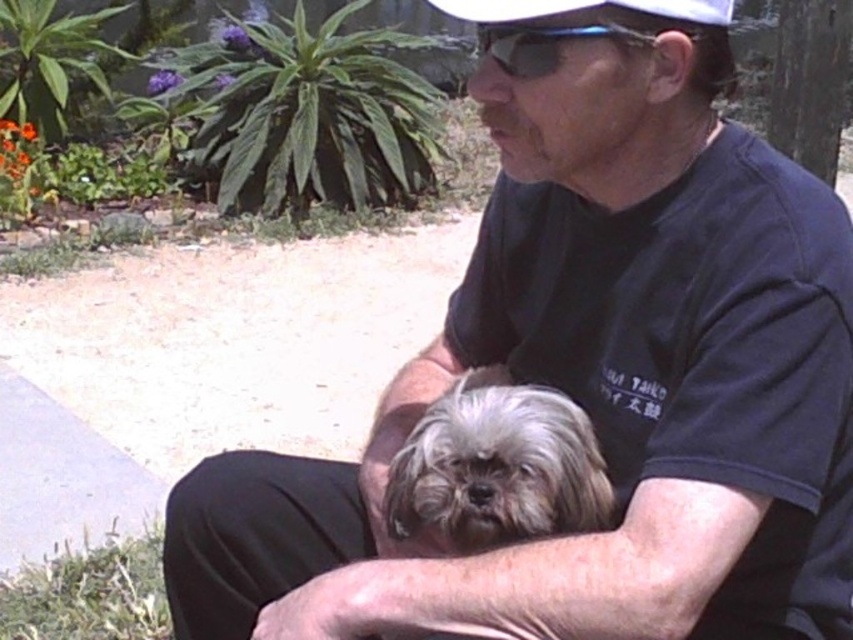
You are a photographer trying to capture a closeup shot of the fluffy gray fur at center and the white matte baseball cap at upper center. Which object should you focus on first if you want to ensure both are in focus without adjusting the camera settings?

The fluffy gray fur at center is taller than the white matte baseball cap at upper center. Therefore, focusing on the taller object first will help ensure both are in focus.

What is the 2D coordinate location of the fluffy gray fur at center in the image?

The 2D coordinate location of the fluffy gray fur at center is at point (496, 468).

You are a photographer trying to capture a closeup shot of the fluffy gray fur at center and the white matte baseball cap at upper center. Which object should you zoom in on to ensure both are in focus without adjusting the camera settings?

The fluffy gray fur at center is larger in size than the white matte baseball cap at upper center, so you should zoom in on the smaller object, the white matte baseball cap at upper center, to ensure both are in focus without changing the camera settings.